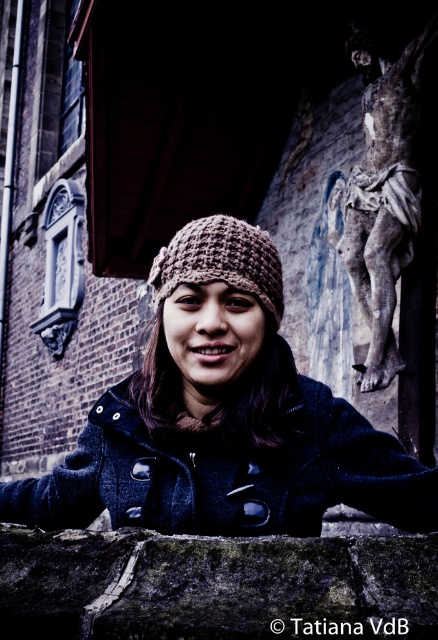
Is brown knitted beanie at center smaller than knitted brown hat at center?

Actually, brown knitted beanie at center might be larger than knitted brown hat at center.

Is point (225, 531) farther from viewer compared to point (182, 237)?

No, (225, 531) is closer to viewer.

Is point (293, 497) positioned after point (240, 236)?

That is False.

Locate an element on the screen. brown knitted beanie at center is located at coordinates (223, 417).

Is weathered stone crucifix at right positioned at the back of knitted brown hat at center?

Yes.

Does weathered stone crucifix at right appear over knitted brown hat at center?

Yes.

Measure the distance between weathered stone crucifix at right and camera.

weathered stone crucifix at right and camera are 47.48 feet apart from each other.

Identify the location of weathered stone crucifix at right. The width and height of the screenshot is (438, 640). (384, 193).

Who is more forward, [236,257] or [392,225]?

Point [236,257]

The height and width of the screenshot is (640, 438). I want to click on brown knitted beanie at center, so click(223, 417).